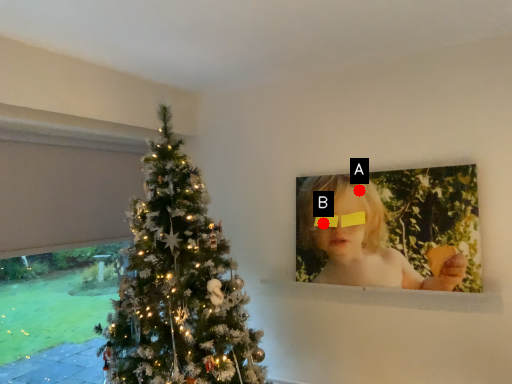
Question: Two points are circled on the image, labeled by A and B beside each circle. Among these points, which one is nearest to the camera?

Choices:
 (A) A is closer
 (B) B is closer

Answer: (A)